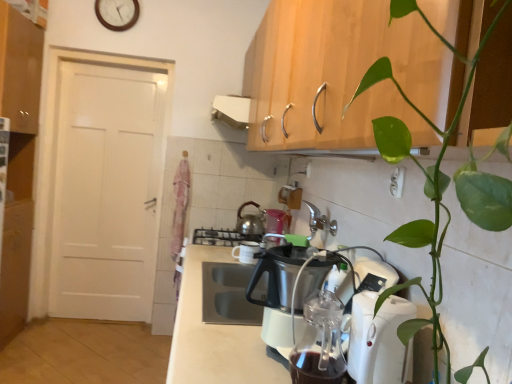
Question: Is white wooden clock at upper center closer to camera compared to white plastic kettle at lower right, which appears as the second kitchen appliance when viewed from the back?

Choices:
 (A) no
 (B) yes

Answer: (A)

Question: Can you confirm if white wooden clock at upper center is thinner than white plastic kettle at lower right, which appears as the second kitchen appliance when viewed from the back?

Choices:
 (A) no
 (B) yes

Answer: (B)

Question: From a real-world perspective, is white wooden clock at upper center located beneath white plastic kettle at lower right, marked as the second kitchen appliance in a left-to-right arrangement?

Choices:
 (A) no
 (B) yes

Answer: (A)

Question: Can we say white wooden clock at upper center lies outside white plastic kettle at lower right, marked as the 1th kitchen appliance in a front-to-back arrangement?

Choices:
 (A) yes
 (B) no

Answer: (A)

Question: Is white wooden clock at upper center to the right of white plastic kettle at lower right, which appears as the second kitchen appliance when viewed from the back, from the viewer's perspective?

Choices:
 (A) yes
 (B) no

Answer: (B)

Question: Does white wooden clock at upper center have a smaller size compared to white plastic kettle at lower right, positioned as the first kitchen appliance in right-to-left order?

Choices:
 (A) yes
 (B) no

Answer: (A)

Question: Is matte wood cabinet at upper left further to camera compared to white plastic countertop at center?

Choices:
 (A) yes
 (B) no

Answer: (A)

Question: Is matte wood cabinet at upper left at the left side of white plastic countertop at center?

Choices:
 (A) no
 (B) yes

Answer: (B)

Question: Can you confirm if matte wood cabinet at upper left is thinner than white plastic countertop at center?

Choices:
 (A) yes
 (B) no

Answer: (A)

Question: Is matte wood cabinet at upper left at the right side of white plastic countertop at center?

Choices:
 (A) no
 (B) yes

Answer: (A)

Question: From the image's perspective, is matte wood cabinet at upper left located above white plastic countertop at center?

Choices:
 (A) no
 (B) yes

Answer: (B)

Question: Can you confirm if matte wood cabinet at upper left is bigger than white plastic countertop at center?

Choices:
 (A) no
 (B) yes

Answer: (B)

Question: Is white wooden clock at upper center not near matte wood cabinet at upper left?

Choices:
 (A) yes
 (B) no

Answer: (B)